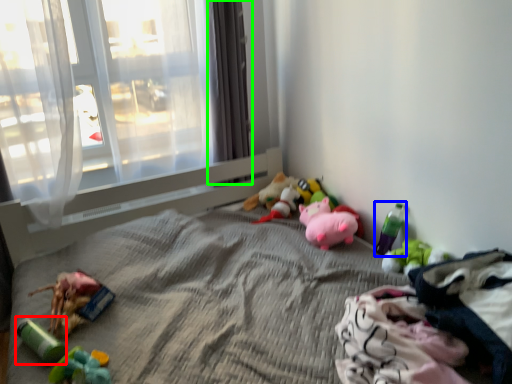
Question: Considering the real-world distances, which object is farthest from toy (highlighted by a red box)? toy (highlighted by a blue box) or curtain (highlighted by a green box)?

Choices:
 (A) toy
 (B) curtain

Answer: (B)